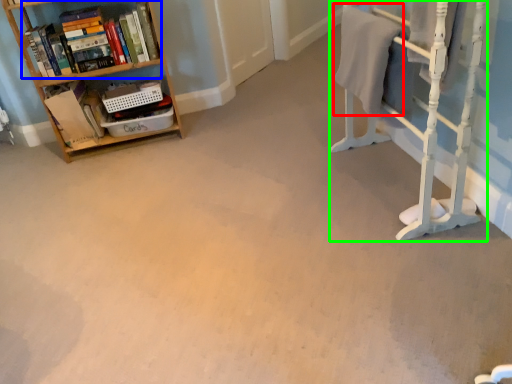
Question: Which object is positioned closest to bath towel (highlighted by a red box)? Select from book (highlighted by a blue box) and bunk bed (highlighted by a green box).

Choices:
 (A) book
 (B) bunk bed

Answer: (B)